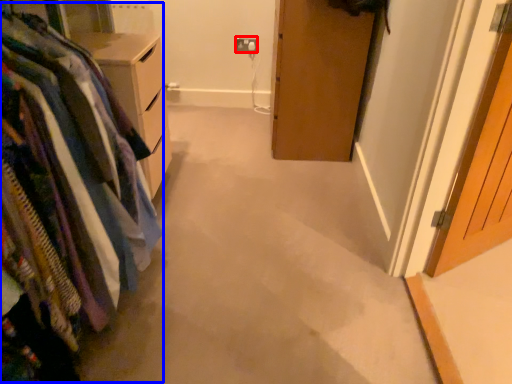
Question: Which object appears closest to the camera in this image, electric outlet (highlighted by a red box) or closet (highlighted by a blue box)?

Choices:
 (A) electric outlet
 (B) closet

Answer: (B)